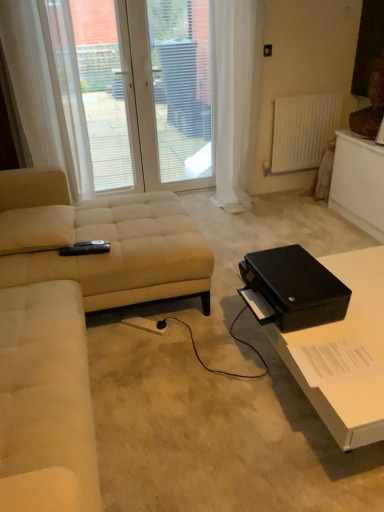
In order to face white sheer curtain at upper center, should I rotate leftwards or rightwards?

It's best to rotate left around 11.668 degrees.

The image size is (384, 512). I want to click on transparent glass door at upper center, so click(136, 92).

What do you see at coordinates (46, 401) in the screenshot? The image size is (384, 512). I see `beige fabric couch at left` at bounding box center [46, 401].

Consider the image. In order to face beige fabric studio couch at left, should I rotate leftwards or rightwards?

To align with it, rotate left about 13.876°.

You are a GUI agent. You are given a task and a screenshot of the screen. Output one action in this format:
    pyautogui.click(x=<x>, y=<y>)
    Task: Click on the white fabric curtain at right, the first curtain viewed from the right
    This screenshot has height=512, width=384.
    Given the screenshot: What is the action you would take?
    pyautogui.click(x=236, y=97)

Who is smaller, white matte radiator at upper right or white sheer curtain at upper center?

Smaller between the two is white matte radiator at upper right.

From the image's perspective, does white matte radiator at upper right appear lower than white sheer curtain at upper center?

Indeed, from the image's perspective, white matte radiator at upper right is shown beneath white sheer curtain at upper center.

Does white matte radiator at upper right turn towards white sheer curtain at upper center?

No, white matte radiator at upper right is not aimed at white sheer curtain at upper center.

Where is `radiator located behind the white sheer curtain at upper center`? The height and width of the screenshot is (512, 384). radiator located behind the white sheer curtain at upper center is located at coordinates (303, 131).

Is the depth of beige fabric studio couch at left greater than that of white plastic screen door at upper center?

No, it is in front of white plastic screen door at upper center.

Can you confirm if beige fabric studio couch at left is wider than white plastic screen door at upper center?

Correct, the width of beige fabric studio couch at left exceeds that of white plastic screen door at upper center.

Considering the positions of points (104, 280) and (203, 39), is point (104, 280) farther from camera compared to point (203, 39)?

No, it is in front of (203, 39).

Is white sheer curtain at upper center not inside beige fabric couch at left?

Yes, white sheer curtain at upper center is not within beige fabric couch at left.

You are a GUI agent. You are given a task and a screenshot of the screen. Output one action in this format:
    pyautogui.click(x=<x>, y=<y>)
    Task: Click on the couch below the white sheer curtain at upper center (from the image's perspective)
    The width and height of the screenshot is (384, 512).
    Given the screenshot: What is the action you would take?
    pyautogui.click(x=46, y=401)

How much distance is there between white sheer curtain at upper center and beige fabric couch at left?

A distance of 6.30 feet exists between white sheer curtain at upper center and beige fabric couch at left.

Which object is thinner, white sheer curtain at upper center or beige fabric couch at left?

Thinner between the two is white sheer curtain at upper center.

Looking at this image, is beige fabric couch at left not within white glossy table at lower right?

Yes, beige fabric couch at left is not within white glossy table at lower right.

From a real-world perspective, relative to white glossy table at lower right, is beige fabric couch at left vertically above or below?

In terms of real-world spatial position, beige fabric couch at left is above white glossy table at lower right.

Is the position of beige fabric couch at left less distant than that of white glossy table at lower right?

Yes, beige fabric couch at left is in front of white glossy table at lower right.

Which is less distant, [192,137] or [0,403]?

Clearly, point [192,137] is more distant from the camera than point [0,403].

Considering the sizes of objects white plastic screen door at upper center and beige fabric couch at left in the image provided, who is smaller, white plastic screen door at upper center or beige fabric couch at left?

With smaller size is white plastic screen door at upper center.

Is white plastic screen door at upper center inside or outside of beige fabric couch at left?

white plastic screen door at upper center lies outside beige fabric couch at left.

Is white fabric curtain at right, the first curtain viewed from the right, positioned with its back to white sheer curtain at left, which appears as the 1th curtain when viewed from the left?

No, white fabric curtain at right, the first curtain viewed from the right,'s orientation is not away from white sheer curtain at left, which appears as the 1th curtain when viewed from the left.

Considering the sizes of white fabric curtain at right, the first curtain viewed from the right, and white sheer curtain at left, which appears as the 1th curtain when viewed from the left, in the image, is white fabric curtain at right, the first curtain viewed from the right, wider or thinner than white sheer curtain at left, which appears as the 1th curtain when viewed from the left,?

white fabric curtain at right, the first curtain viewed from the right, is wider than white sheer curtain at left, which appears as the 1th curtain when viewed from the left.

Measure the distance between white sheer curtain at upper center and white glossy table at lower right.

white sheer curtain at upper center and white glossy table at lower right are 2.14 meters apart from each other.

From a real-world perspective, is white sheer curtain at upper center below white glossy table at lower right?

No, from a real-world perspective, white sheer curtain at upper center is not below white glossy table at lower right.

Considering the positions of point (93, 110) and point (275, 332), is point (93, 110) closer or farther from the camera than point (275, 332)?

Point (93, 110).

Is white sheer curtain at upper center positioned behind white glossy table at lower right?

Yes, white sheer curtain at upper center is further from the viewer.

In the image, there is a white sheer curtain at upper center. Identify the location of radiator below it (from a real-world perspective). The width and height of the screenshot is (384, 512). (303, 131).

The image size is (384, 512). In order to click on studio couch that is below the white plastic screen door at upper center (from the image's perspective) in this screenshot , I will do `click(100, 239)`.

Which object lies nearer to the anchor point transparent glass door at upper center, white sheer curtain at left, the 2th curtain positioned from the right, or white glossy table at lower right?

Among the two, white sheer curtain at left, the 2th curtain positioned from the right, is located nearer to transparent glass door at upper center.

Looking at the image, which one is located further to transparent glass door at upper center, white fabric curtain at right, the first curtain viewed from the right, or white matte radiator at upper right?

The object further to transparent glass door at upper center is white matte radiator at upper right.

When comparing their distances from beige fabric couch at left, does white fabric curtain at right, the first curtain viewed from the right, or white sheer curtain at upper center seem further?

Among the two, white fabric curtain at right, the first curtain viewed from the right, is located further to beige fabric couch at left.

Which object lies nearer to the anchor point beige fabric studio couch at left, white glossy table at lower right or transparent glass door at upper center?

Based on the image, white glossy table at lower right appears to be nearer to beige fabric studio couch at left.

Based on their spatial positions, is beige fabric studio couch at left or white fabric curtain at right, positioned as the second curtain in left-to-right order, closer to white glossy table at lower right?

beige fabric studio couch at left is closer to white glossy table at lower right.

Considering their positions, is transparent glass door at upper center positioned further to beige fabric couch at left than white plastic screen door at upper center?

Among the two, white plastic screen door at upper center is located further to beige fabric couch at left.

From the picture: Estimate the real-world distances between objects in this image. Which object is closer to beige fabric studio couch at left, white fabric curtain at right, positioned as the second curtain in left-to-right order, or beige fabric couch at left?

beige fabric couch at left is closer to beige fabric studio couch at left.

From the image, which object appears to be farther from white glossy table at lower right, white sheer curtain at left, which appears as the 1th curtain when viewed from the left, or transparent glass door at upper center?

white sheer curtain at left, which appears as the 1th curtain when viewed from the left.

The image size is (384, 512). I want to click on studio couch between beige fabric couch at left and white matte radiator at upper right in the front-back direction, so click(x=100, y=239).

Where is `glass door between white glossy table at lower right and white matte radiator at upper right in the front-back direction`? glass door between white glossy table at lower right and white matte radiator at upper right in the front-back direction is located at coordinates (136, 92).

Where is `studio couch between white fabric curtain at right, positioned as the second curtain in left-to-right order, and white glossy table at lower right vertically`? The width and height of the screenshot is (384, 512). studio couch between white fabric curtain at right, positioned as the second curtain in left-to-right order, and white glossy table at lower right vertically is located at coordinates (100, 239).

Locate an element on the screen. This screenshot has width=384, height=512. studio couch between beige fabric couch at left and white plastic screen door at upper center from front to back is located at coordinates (100, 239).